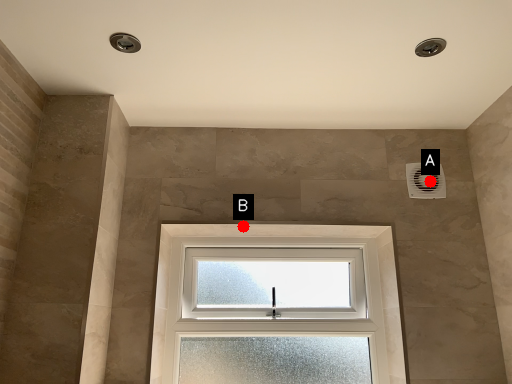
Question: Two points are circled on the image, labeled by A and B beside each circle. Which point is closer to the camera?

Choices:
 (A) A is closer
 (B) B is closer

Answer: (B)